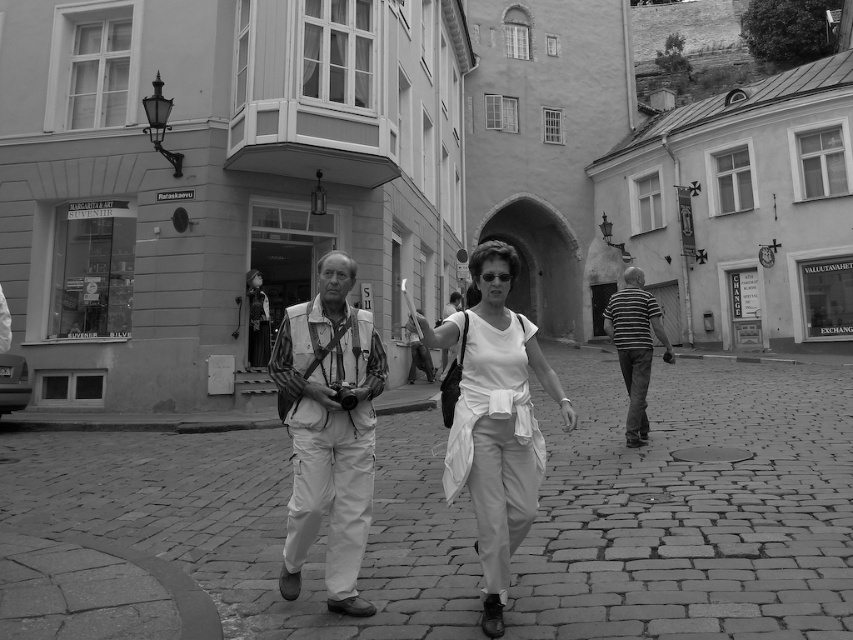
Question: Is matte white vest at center wider than striped cotton shirt at center?

Choices:
 (A) no
 (B) yes

Answer: (A)

Question: Which point is farther to the camera?

Choices:
 (A) coord(486,310)
 (B) coord(300,342)

Answer: (B)

Question: Estimate the real-world distances between objects in this image. Which object is closer to the striped cotton shirt at center?

Choices:
 (A) matte white vest at center
 (B) white cotton shirt at center

Answer: (B)

Question: Is matte white vest at center bigger than white cotton shirt at center?

Choices:
 (A) no
 (B) yes

Answer: (B)

Question: Estimate the real-world distances between objects in this image. Which object is closer to the matte white vest at center?

Choices:
 (A) white cotton shirt at center
 (B) striped cotton shirt at center

Answer: (A)

Question: Is matte white vest at center further to camera compared to striped cotton shirt at center?

Choices:
 (A) yes
 (B) no

Answer: (B)